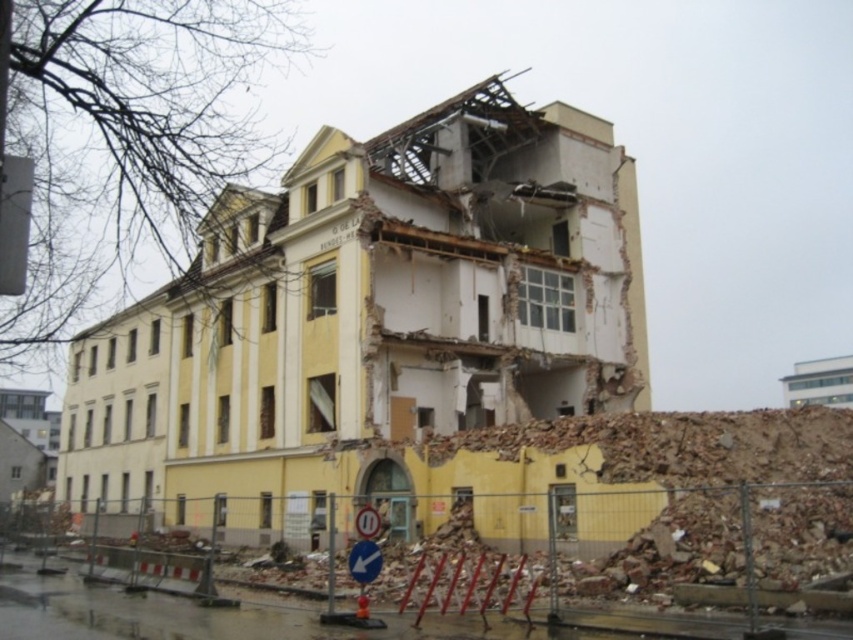
Question: Does yellow/white concrete building at center appear under crumbled concrete debris at center?

Choices:
 (A) no
 (B) yes

Answer: (A)

Question: Can you confirm if yellow/white concrete building at center is wider than crumbled concrete debris at center?

Choices:
 (A) yes
 (B) no

Answer: (A)

Question: Can you confirm if yellow/white concrete building at center is positioned to the right of crumbled concrete debris at center?

Choices:
 (A) no
 (B) yes

Answer: (A)

Question: Which point appears closest to the camera in this image?

Choices:
 (A) (376, 504)
 (B) (450, 344)

Answer: (A)